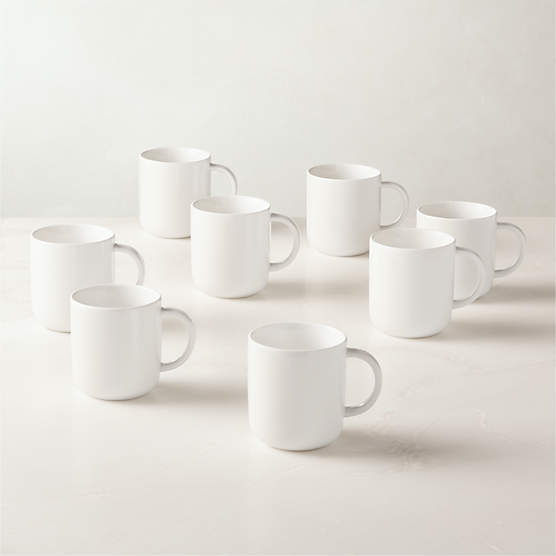
What are the coordinates of `white inside of the teacup` in the screenshot? It's located at (114, 297), (67, 238), (171, 156), (230, 206), (345, 176), (451, 212), (409, 242), (302, 339).